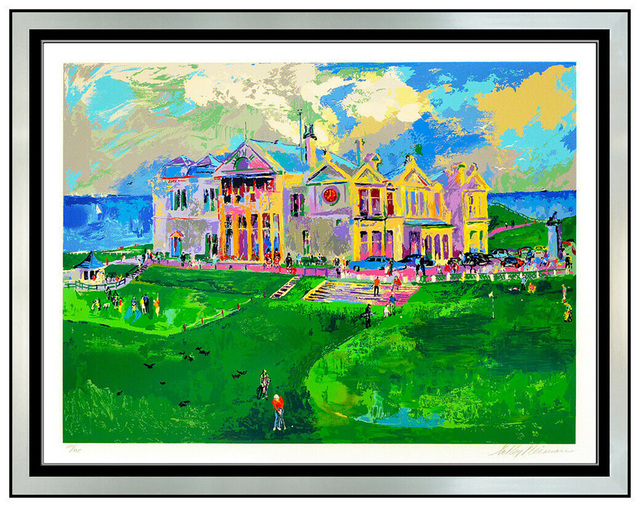
Locate an element on the screen. silver frame is located at coordinates (620, 342).